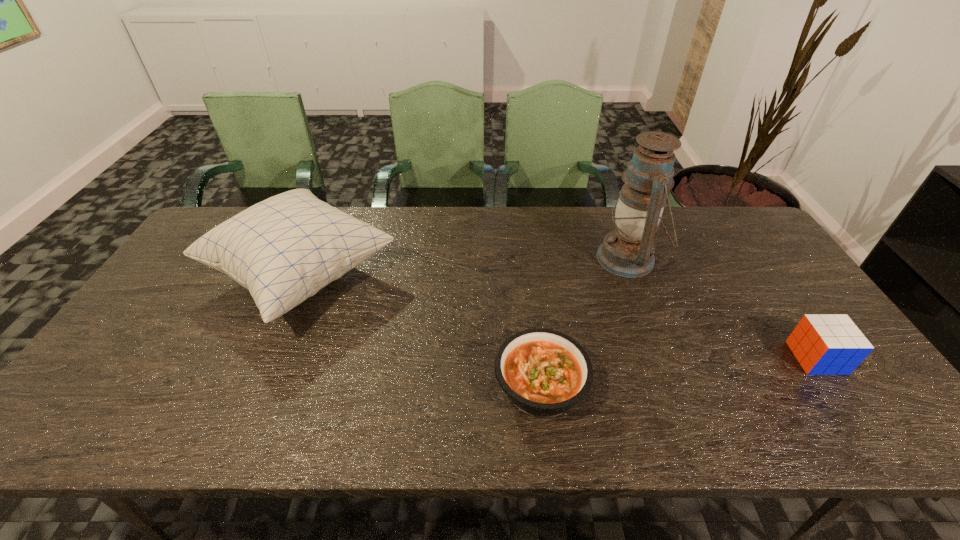
Locate an element on the screen. free region at the left edge is located at coordinates (215, 285).

Where is `vacant space at the right edge of the desktop`? vacant space at the right edge of the desktop is located at coordinates (793, 287).

In the image, there is a desktop. Where is `vacant space at the far left corner`? The height and width of the screenshot is (540, 960). vacant space at the far left corner is located at coordinates (218, 216).

In the image, there is a desktop. Where is `vacant space at the far right corner`? The width and height of the screenshot is (960, 540). vacant space at the far right corner is located at coordinates (702, 221).

Find the location of a particular element. vacant area that lies between the rightmost object and the second object from left to right is located at coordinates (679, 372).

This screenshot has height=540, width=960. Identify the location of vacant area that lies between the second object from left to right and the cube. (679, 372).

Where is `free space between the cube and the cushion`? free space between the cube and the cushion is located at coordinates click(x=559, y=316).

Where is `free spot between the third shortest object and the shortest object`? This screenshot has width=960, height=540. free spot between the third shortest object and the shortest object is located at coordinates (421, 330).

The width and height of the screenshot is (960, 540). Identify the location of free space that is in between the third tallest object and the leftmost object. (559, 316).

Find the location of a particular element. The width and height of the screenshot is (960, 540). free spot between the tallest object and the cube is located at coordinates (722, 308).